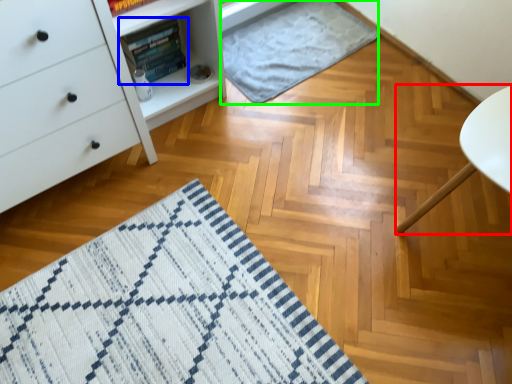
Question: Which object is the farthest from furniture (highlighted by a red box)? Choose among these: book (highlighted by a blue box) or blanket (highlighted by a green box).

Choices:
 (A) book
 (B) blanket

Answer: (A)